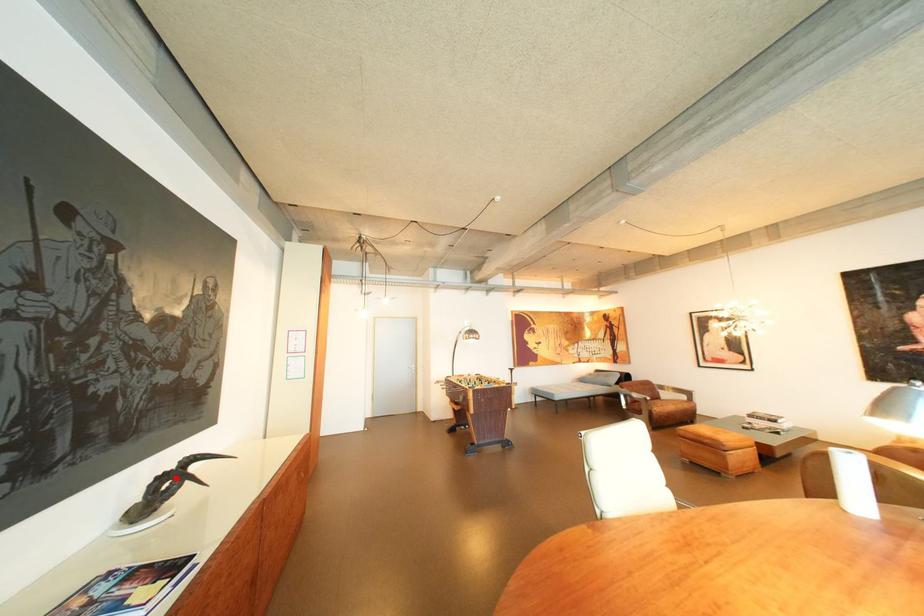
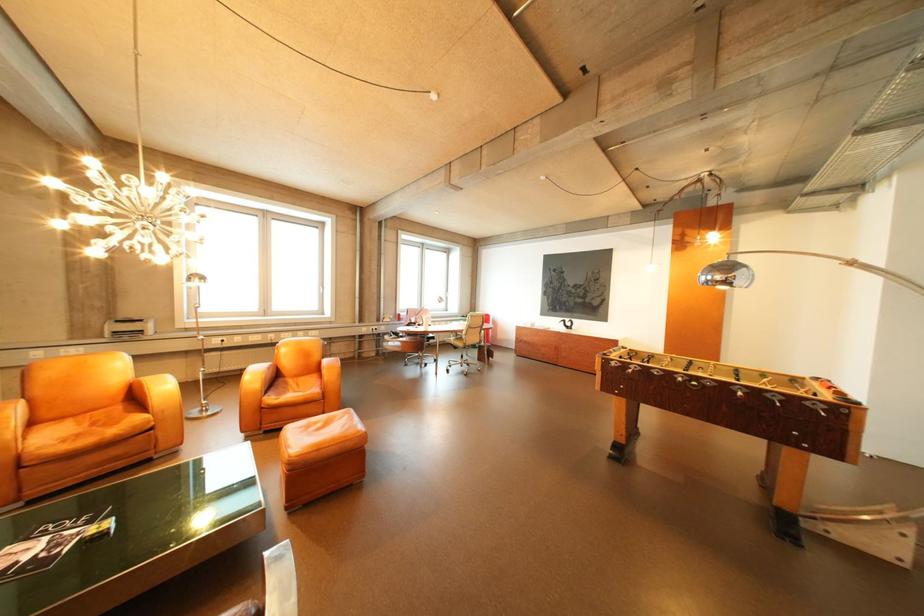
In the second image, find the point that corresponds to the highlighted location in the first image.

(578, 322)